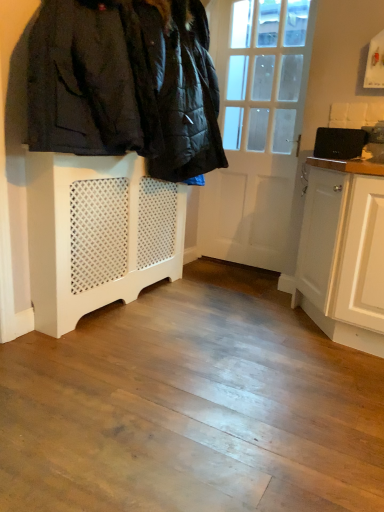
At what (x,y) coordinates should I click in order to perform the action: click on vacant space to the right of white painted wood radiator at lower left. Please return your answer as a coordinate pair (x, y). Looking at the image, I should click on (224, 307).